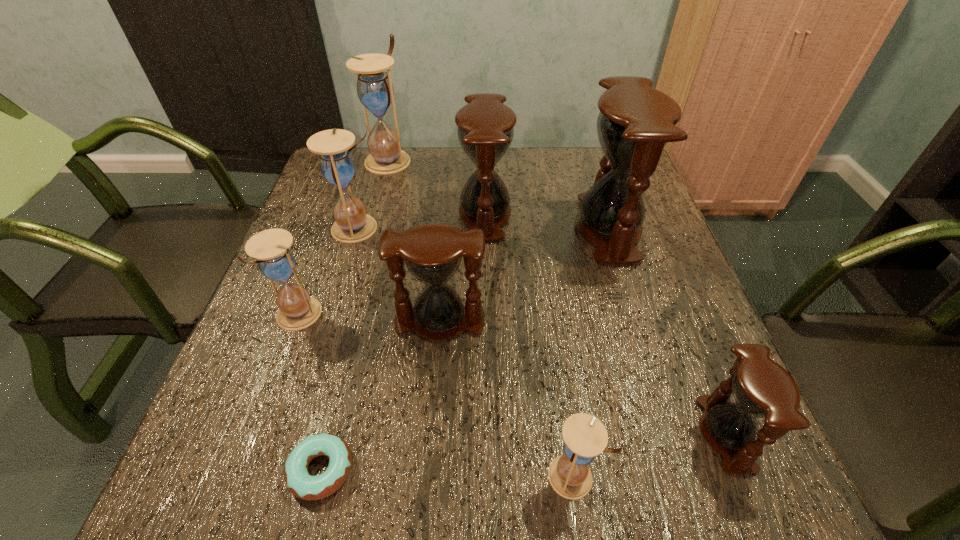
The height and width of the screenshot is (540, 960). Find the location of `vacant position in the image that satisfies the following two spatial constraints: 1. on the back side of the rightmost white hourglass; 2. on the right side of the biggest brown hourglass`. vacant position in the image that satisfies the following two spatial constraints: 1. on the back side of the rightmost white hourglass; 2. on the right side of the biggest brown hourglass is located at coordinates (538, 228).